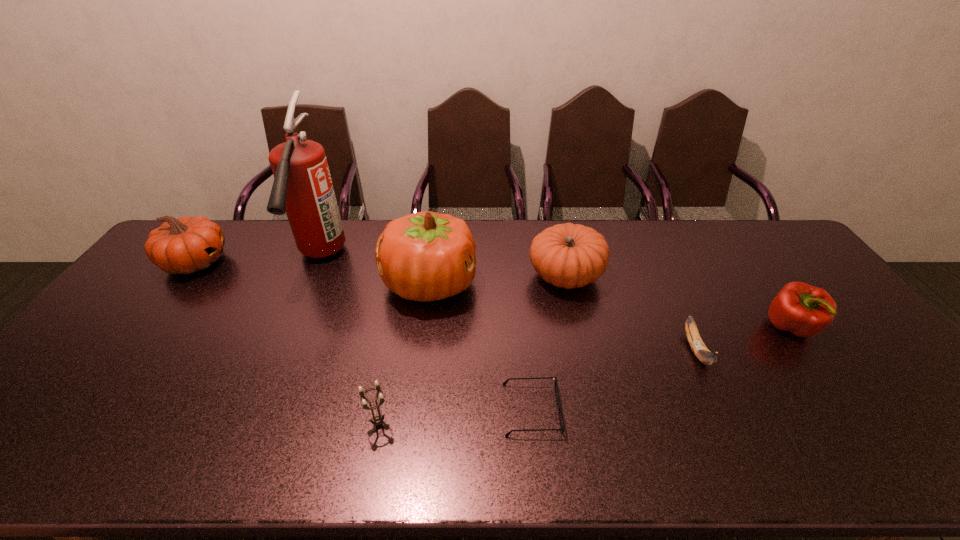
Where is `the second object from left to right`? the second object from left to right is located at coordinates point(302,188).

The image size is (960, 540). What are the coordinates of `fire extinguisher` in the screenshot? It's located at (302, 188).

The image size is (960, 540). I want to click on the seventh shortest object, so click(x=425, y=256).

Identify the location of the tallest pumpkin. (425, 256).

You are a GUI agent. You are given a task and a screenshot of the screen. Output one action in this format:
    pyautogui.click(x=<x>, y=<y>)
    Task: Click on the leftmost pumpkin
    
    Given the screenshot: What is the action you would take?
    pyautogui.click(x=186, y=245)

Where is `the rightmost pumpkin`? the rightmost pumpkin is located at coordinates (567, 255).

This screenshot has height=540, width=960. I want to click on the rightmost object, so click(804, 310).

Where is `candle holder`? The width and height of the screenshot is (960, 540). candle holder is located at coordinates (377, 419).

This screenshot has width=960, height=540. In order to click on banana in this screenshot , I will do `click(696, 343)`.

Where is `the second shortest object`? The image size is (960, 540). the second shortest object is located at coordinates (696, 343).